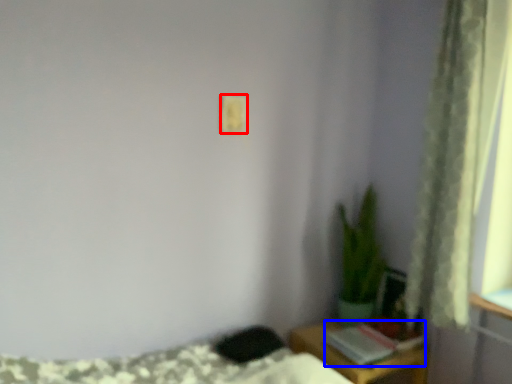
Question: Which object appears farthest to the camera in this image, light switch (highlighted by a red box) or book (highlighted by a blue box)?

Choices:
 (A) light switch
 (B) book

Answer: (B)